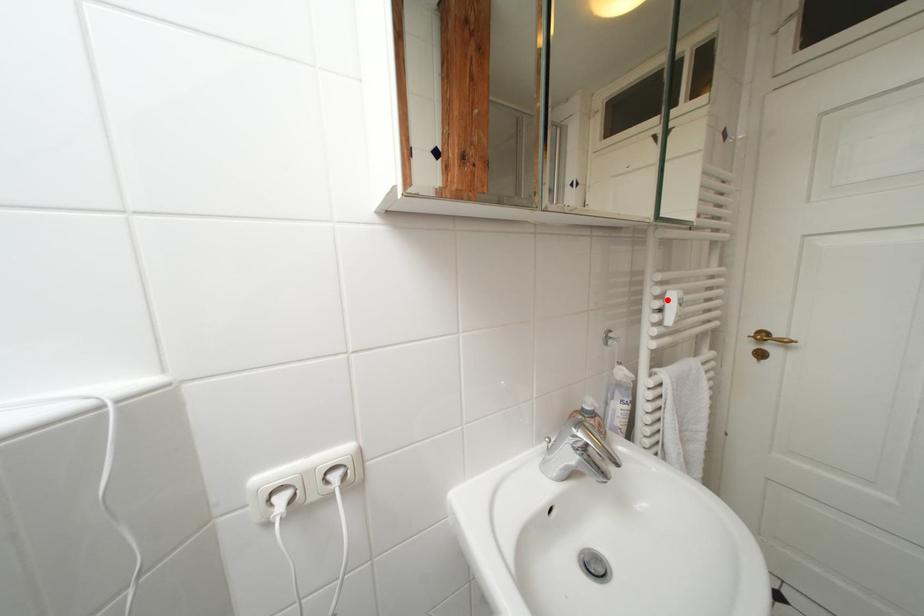
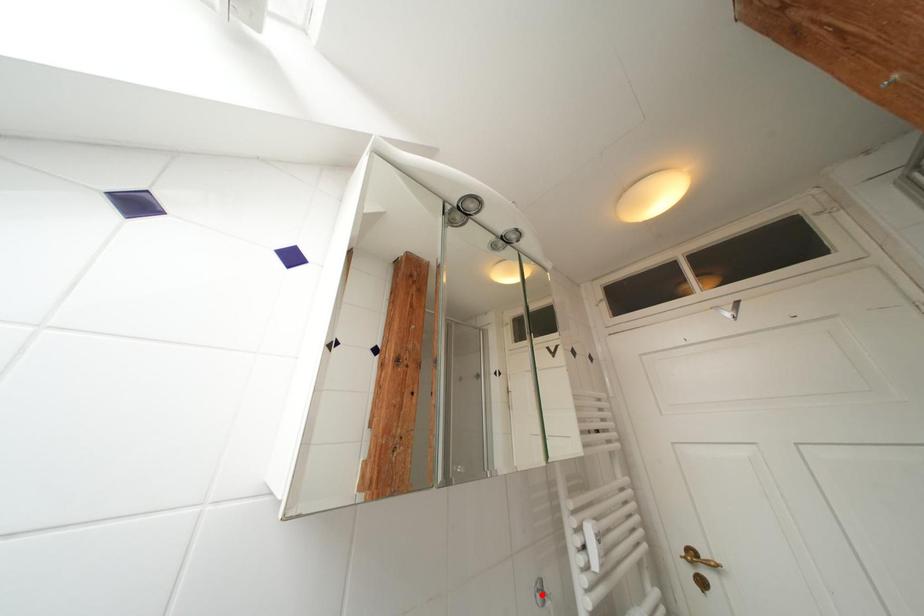
I am providing you with two images of the same scene from different viewpoints. A red point is marked on the first image and another point is marked on the second image. Are the points marked in image1 and image2 representing the same 3D position?

No